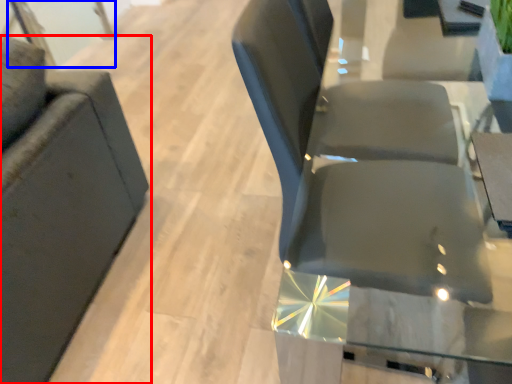
Question: Which point is closer to the camera, chair (highlighted by a red box) or glass door (highlighted by a blue box)?

Choices:
 (A) chair
 (B) glass door

Answer: (A)